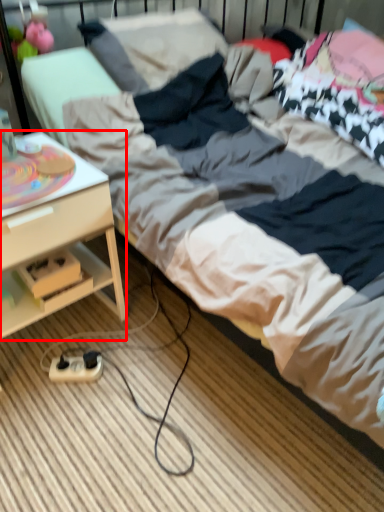
Question: From the image's perspective, what is the correct spatial positioning of desk (annotated by the red box) in reference to extension cord?

Choices:
 (A) above
 (B) below

Answer: (A)